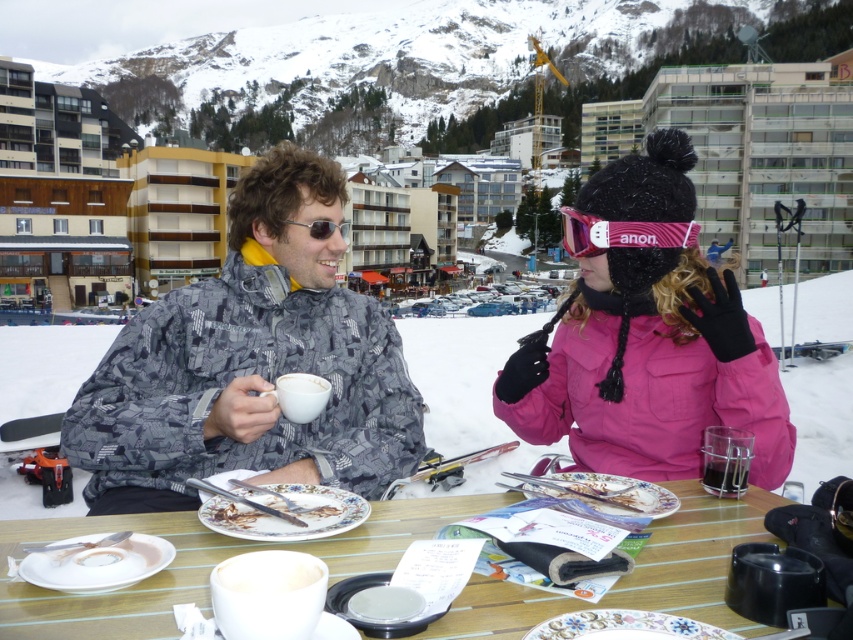
Question: Does porcelain plate with food remnants at center have a larger size compared to white matte cup at center?

Choices:
 (A) no
 (B) yes

Answer: (B)

Question: Where is pink waterproof jacket at center located in relation to white matte cup at center in the image?

Choices:
 (A) right
 (B) left

Answer: (A)

Question: Which of these objects is positioned farthest from the wooden table at center?

Choices:
 (A) clear plastic cup at lower center
 (B) matte gray jacket at center

Answer: (B)

Question: Which object is farther from the camera taking this photo?

Choices:
 (A) wooden table at center
 (B) matte gray jacket at center
 (C) sunglasses at center
 (D) pink waterproof jacket at center

Answer: (C)

Question: Which object is the farthest from the white matte cup at center?

Choices:
 (A) porcelain plate with food remnants at center
 (B) clear plastic cup at lower center

Answer: (B)

Question: Is camouflage jacket at center in front of shiny silver fork at center?

Choices:
 (A) yes
 (B) no

Answer: (B)